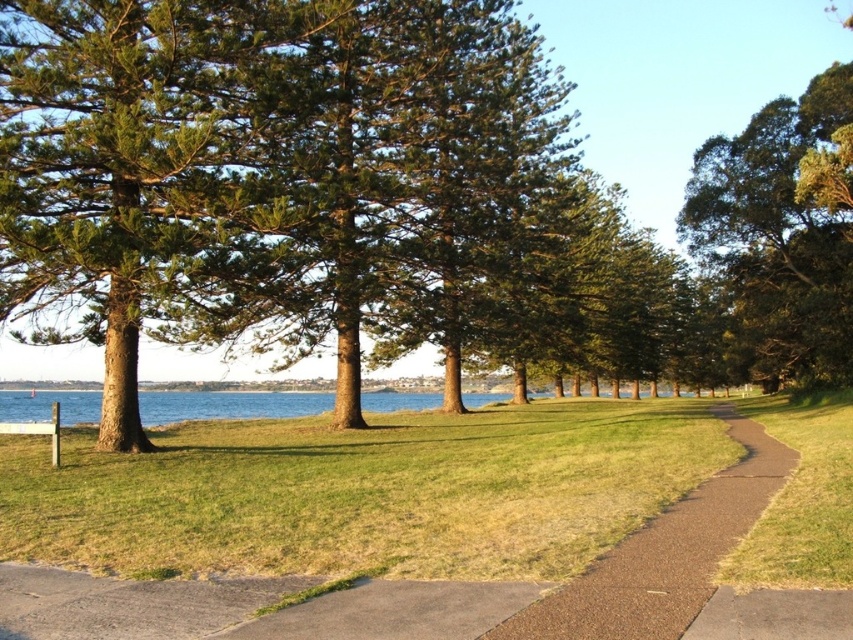
Question: Can you confirm if green textured pine tree at center is bigger than brown asphalt path at center?

Choices:
 (A) no
 (B) yes

Answer: (B)

Question: Is green textured pine tree at center wider than brown asphalt path at center?

Choices:
 (A) no
 (B) yes

Answer: (B)

Question: Among these points, which one is farthest from the camera?

Choices:
 (A) (598, 621)
 (B) (718, 177)

Answer: (B)

Question: Which point appears farthest from the camera in this image?

Choices:
 (A) (676, 627)
 (B) (614, 250)

Answer: (B)

Question: From the image, what is the correct spatial relationship of green textured pine tree at center in relation to brown asphalt path at center?

Choices:
 (A) right
 (B) left

Answer: (A)